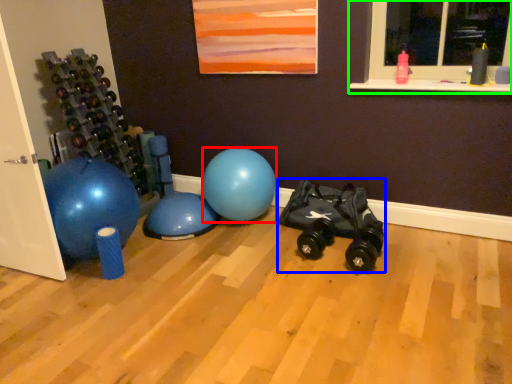
Question: Which object is the farthest from ball (highlighted by a red box)? Choose among these: toy car (highlighted by a blue box) or window (highlighted by a green box).

Choices:
 (A) toy car
 (B) window

Answer: (B)